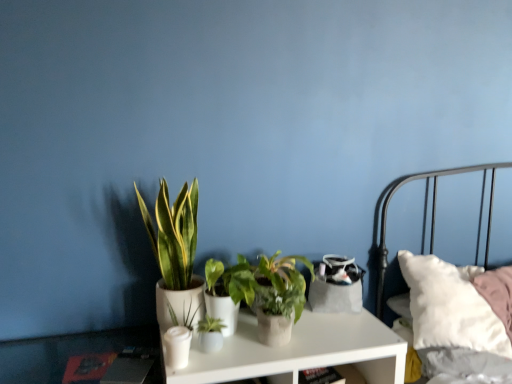
Identify the location of unoccupied region to the right of green matte plant at center, which is the 4th houseplant from left to right. (348, 328).